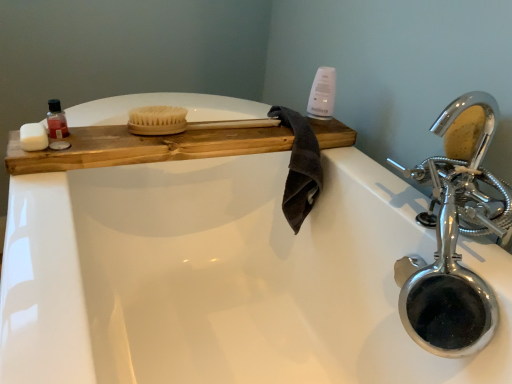
Question: Can we say translucent plastic bottle at upper left lies outside chrome/metallic faucet at right?

Choices:
 (A) yes
 (B) no

Answer: (A)

Question: From the image's perspective, is translucent plastic bottle at upper left under chrome/metallic faucet at right?

Choices:
 (A) yes
 (B) no

Answer: (B)

Question: Is translucent plastic bottle at upper left shorter than chrome/metallic faucet at right?

Choices:
 (A) no
 (B) yes

Answer: (B)

Question: Does translucent plastic bottle at upper left appear on the right side of chrome/metallic faucet at right?

Choices:
 (A) yes
 (B) no

Answer: (B)

Question: Considering the relative sizes of translucent plastic bottle at upper left and chrome/metallic faucet at right in the image provided, is translucent plastic bottle at upper left smaller than chrome/metallic faucet at right?

Choices:
 (A) yes
 (B) no

Answer: (A)

Question: Could you tell me if translucent plastic bottle at upper left is facing chrome/metallic faucet at right?

Choices:
 (A) yes
 (B) no

Answer: (B)

Question: From the image's perspective, would you say white matte soap at left is shown under dark brown cotton towel at center?

Choices:
 (A) yes
 (B) no

Answer: (B)

Question: Is white matte soap at left outside dark brown cotton towel at center?

Choices:
 (A) no
 (B) yes

Answer: (B)

Question: Is white matte soap at left positioned behind dark brown cotton towel at center?

Choices:
 (A) yes
 (B) no

Answer: (B)

Question: Can you confirm if white matte soap at left is positioned to the left of dark brown cotton towel at center?

Choices:
 (A) yes
 (B) no

Answer: (A)

Question: Is the position of white matte soap at left less distant than that of dark brown cotton towel at center?

Choices:
 (A) yes
 (B) no

Answer: (A)

Question: Considering the relative sizes of white matte soap at left and dark brown cotton towel at center in the image provided, is white matte soap at left smaller than dark brown cotton towel at center?

Choices:
 (A) no
 (B) yes

Answer: (B)

Question: Considering the relative sizes of wooden tray at upper left and translucent plastic bottle at upper left in the image provided, is wooden tray at upper left thinner than translucent plastic bottle at upper left?

Choices:
 (A) yes
 (B) no

Answer: (B)